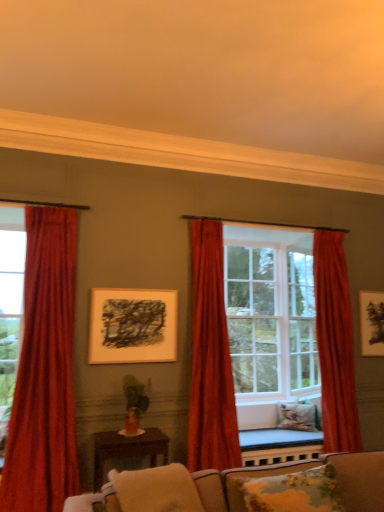
Question: From a real-world perspective, relative to clear glass door at center, which appears as the 1th glass door when viewed from the right, is brown wooden table at center vertically above or below?

Choices:
 (A) below
 (B) above

Answer: (A)

Question: Is brown wooden table at center taller or shorter than clear glass door at center, which is the first glass door in back-to-front order?

Choices:
 (A) tall
 (B) short

Answer: (B)

Question: Which object is positioned closest to the velvet red curtain at center, which is counted as the second curtain, starting from the left?

Choices:
 (A) fluffy floral pillow at lower right, acting as the second pillow starting from the back
 (B) velvet red curtain at right, the 3th curtain in the left-to-right sequence
 (C) transparent glass door at left, which appears as the 1th glass door when viewed from the front
 (D) fluffy beige pillow at lower center, marked as the third pillow in a right-to-left arrangement
 (E) brown wooden table at center

Answer: (E)

Question: Which object is positioned farthest from the velvet red curtain at center, which is counted as the second curtain, starting from the left?

Choices:
 (A) velvet beige couch at lower center
 (B) velvet red curtain at left, which is the 3th curtain from right to left
 (C) fluffy white pillow at lower right, placed as the first pillow when sorted from right to left
 (D) fluffy floral pillow at lower right, which ranks as the second pillow in front-to-back order
 (E) clear glass door at center, marked as the second glass door in a front-to-back arrangement

Answer: (C)